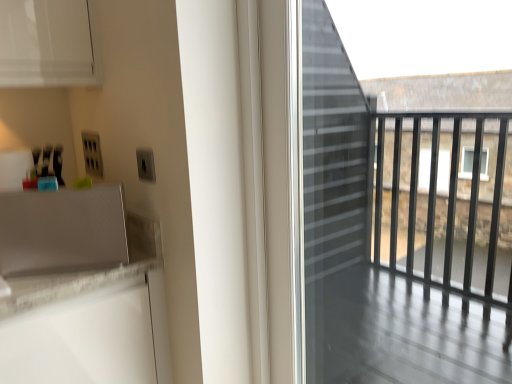
Question: Is transparent glass screen door at right far from satin silver speaker at lower left?

Choices:
 (A) no
 (B) yes

Answer: (B)

Question: Is transparent glass screen door at right directly adjacent to satin silver speaker at lower left?

Choices:
 (A) no
 (B) yes

Answer: (A)

Question: Does transparent glass screen door at right have a lesser width compared to satin silver speaker at lower left?

Choices:
 (A) no
 (B) yes

Answer: (B)

Question: From the image's perspective, is transparent glass screen door at right located beneath satin silver speaker at lower left?

Choices:
 (A) no
 (B) yes

Answer: (B)

Question: Is transparent glass screen door at right at the left side of satin silver speaker at lower left?

Choices:
 (A) yes
 (B) no

Answer: (B)

Question: Can you confirm if transparent glass screen door at right is positioned to the right of satin silver speaker at lower left?

Choices:
 (A) yes
 (B) no

Answer: (A)

Question: Is transparent glass screen door at right surrounded by satin silver speaker at lower left?

Choices:
 (A) no
 (B) yes

Answer: (A)

Question: Can you confirm if satin silver speaker at lower left is shorter than transparent glass screen door at right?

Choices:
 (A) no
 (B) yes

Answer: (B)

Question: Are satin silver speaker at lower left and transparent glass screen door at right beside each other?

Choices:
 (A) no
 (B) yes

Answer: (A)

Question: Are satin silver speaker at lower left and transparent glass screen door at right located far from each other?

Choices:
 (A) no
 (B) yes

Answer: (B)

Question: From a real-world perspective, is satin silver speaker at lower left located higher than transparent glass screen door at right?

Choices:
 (A) yes
 (B) no

Answer: (B)

Question: Is satin silver speaker at lower left further to camera compared to transparent glass screen door at right?

Choices:
 (A) yes
 (B) no

Answer: (A)

Question: From a real-world perspective, is satin silver speaker at lower left positioned above or below transparent glass screen door at right?

Choices:
 (A) above
 (B) below

Answer: (B)